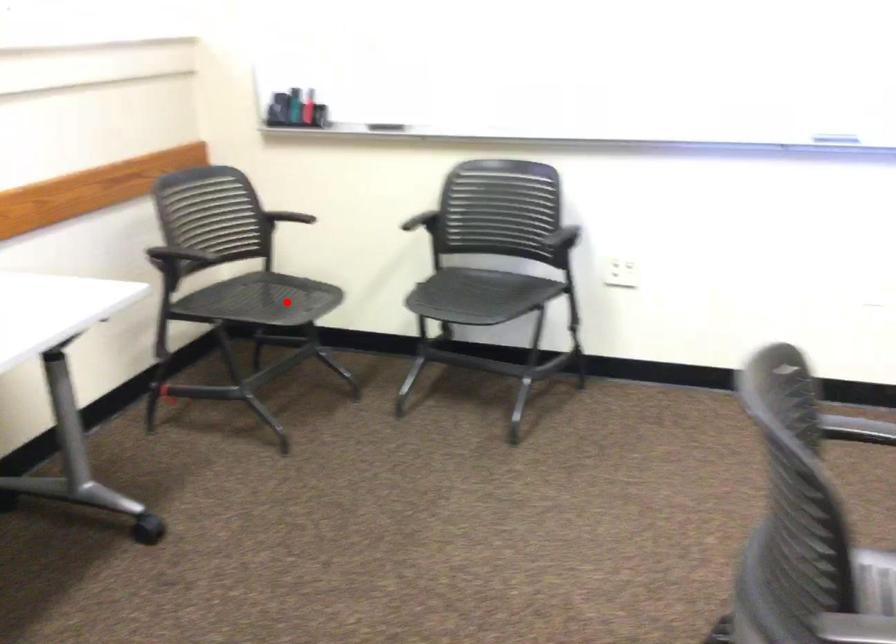
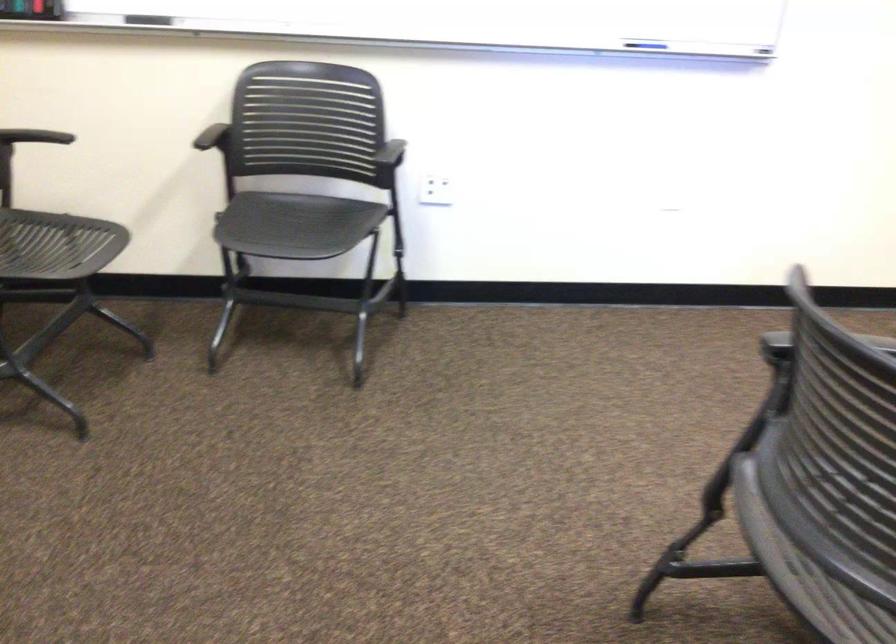
Locate, in the second image, the point that corresponds to the highlighted location in the first image.

(56, 245)